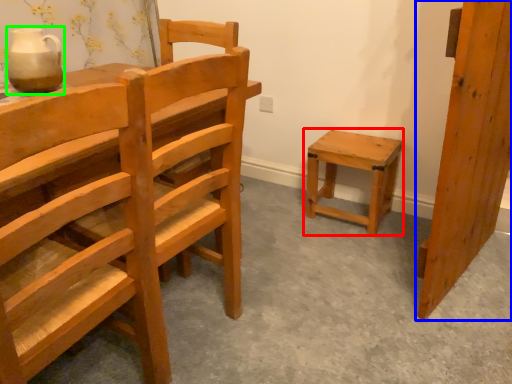
Question: Considering the real-world distances, which object is closest to stool (highlighted by a red box)? wood (highlighted by a blue box) or pottery (highlighted by a green box).

Choices:
 (A) wood
 (B) pottery

Answer: (A)